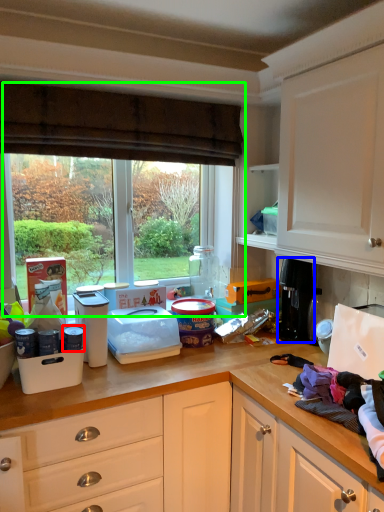
Question: Which is farther away from appliance (highlighted by a red box)? appliance (highlighted by a blue box) or window (highlighted by a green box)?

Choices:
 (A) appliance
 (B) window

Answer: (A)